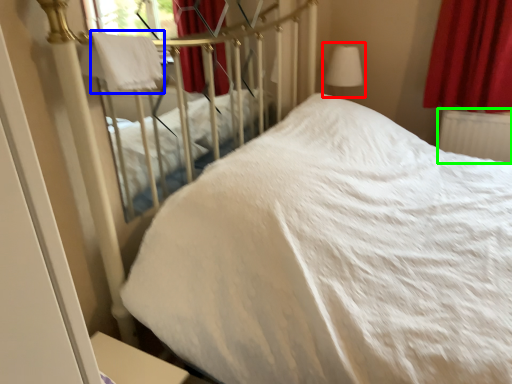
Question: Which object is the closest to the table lamp (highlighted by a red box)? Choose among these: blanket (highlighted by a blue box) or radiator (highlighted by a green box).

Choices:
 (A) blanket
 (B) radiator

Answer: (B)